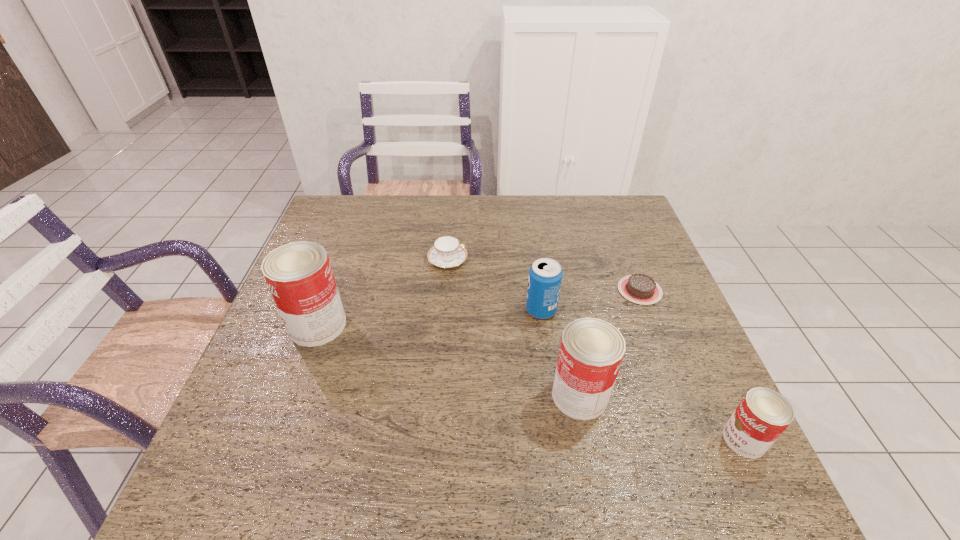
I want to click on free space located on the front label of the second tallest object, so click(696, 395).

Locate an element on the screen. free space located 0.160m on the front label of the nearest object is located at coordinates (644, 439).

You are a GUI agent. You are given a task and a screenshot of the screen. Output one action in this format:
    pyautogui.click(x=<x>, y=<y>)
    Task: Click on the free region located on the front label of the nearest object
    Image resolution: width=960 pixels, height=540 pixels.
    Given the screenshot: What is the action you would take?
    pyautogui.click(x=613, y=439)

You are a GUI agent. You are given a task and a screenshot of the screen. Output one action in this format:
    pyautogui.click(x=<x>, y=<y>)
    Task: Click on the vacant space located 0.300m on the front label of the nearest object
    
    Given the screenshot: What is the action you would take?
    pyautogui.click(x=573, y=439)

Find the location of a particular element. This screenshot has height=540, width=960. free space located on the left of the shortest object is located at coordinates (489, 291).

I want to click on free location located on the side with the handle of the farthest object, so click(488, 260).

Locate an element on the screen. The width and height of the screenshot is (960, 540). free space located on the back of the third tallest object is located at coordinates click(537, 281).

Identify the location of object located in the left edge section of the desktop. The width and height of the screenshot is (960, 540). (299, 275).

The image size is (960, 540). Find the location of `can located at the right edge`. can located at the right edge is located at coordinates coord(762,416).

This screenshot has width=960, height=540. Identify the location of chocolate cake at the right edge. (638, 288).